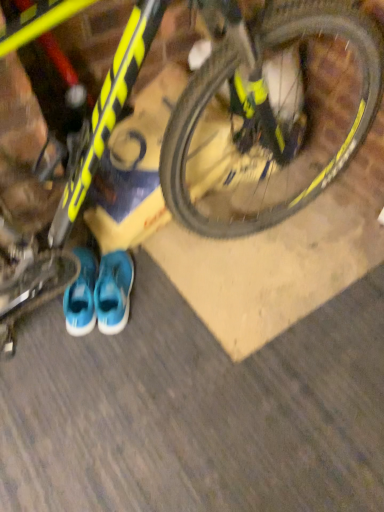
Question: In the image, is yellow matte bicycle at upper center on the left side or the right side of blue fabric sneakers at lower center?

Choices:
 (A) left
 (B) right

Answer: (B)

Question: Considering their positions, is yellow matte bicycle at upper center located in front of or behind blue fabric sneakers at lower center?

Choices:
 (A) front
 (B) behind

Answer: (A)

Question: Considering the real-world distances, which object is farthest from the yellow matte bicycle at upper center?

Choices:
 (A) yellow matte bicycle at upper center
 (B) blue fabric sneakers at lower center
 (C) blue fabric running shoe at lower center

Answer: (B)

Question: Estimate the real-world distances between objects in this image. Which object is closer to the blue fabric running shoe at lower center?

Choices:
 (A) yellow matte bicycle at upper center
 (B) blue fabric sneakers at lower center
 (C) yellow matte bicycle at upper center

Answer: (B)